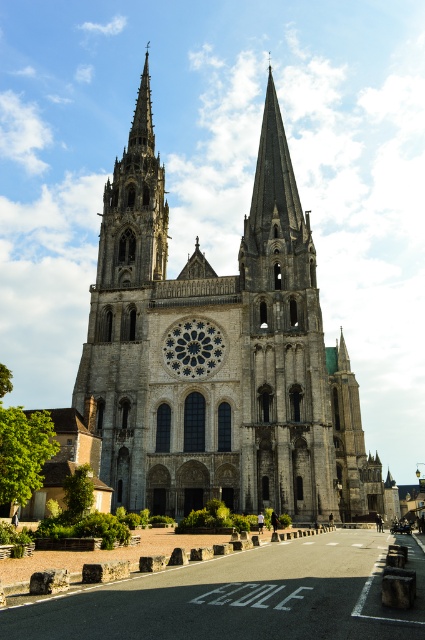
You are standing in front of the cathedral and notice two points marked on the facade. The first point is at coordinates point (224, 358) and the second is at point (217, 342). From your perspective, which point appears closer to you?

Point (224, 358) is in front of point (217, 342), so it appears closer to you.

You are an architect analyzing the cathedral. You need to determine which structure is wider between the gray stone church at center and the smooth stone spire at upper left. Which one is wider?

The gray stone church at center is wider than the smooth stone spire at upper left according to the description.